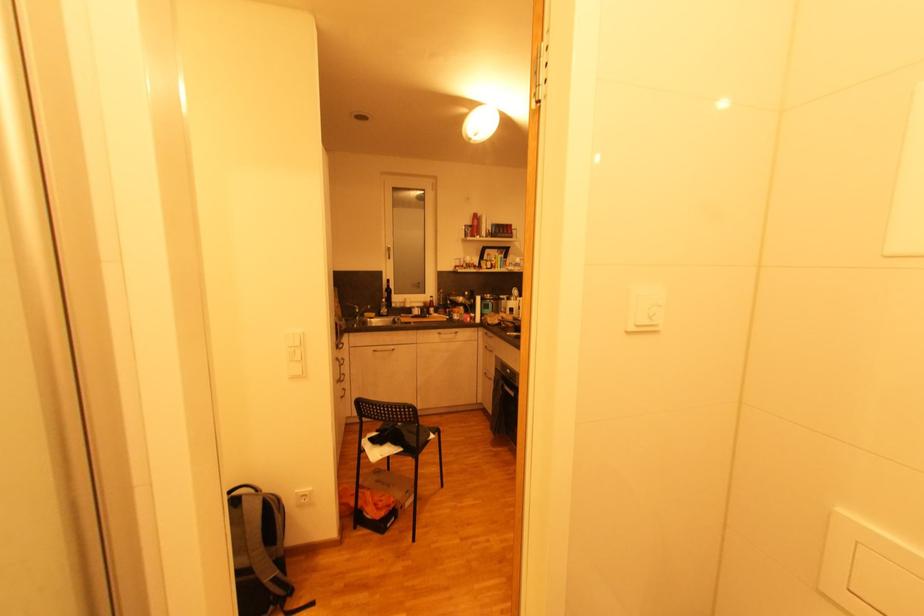
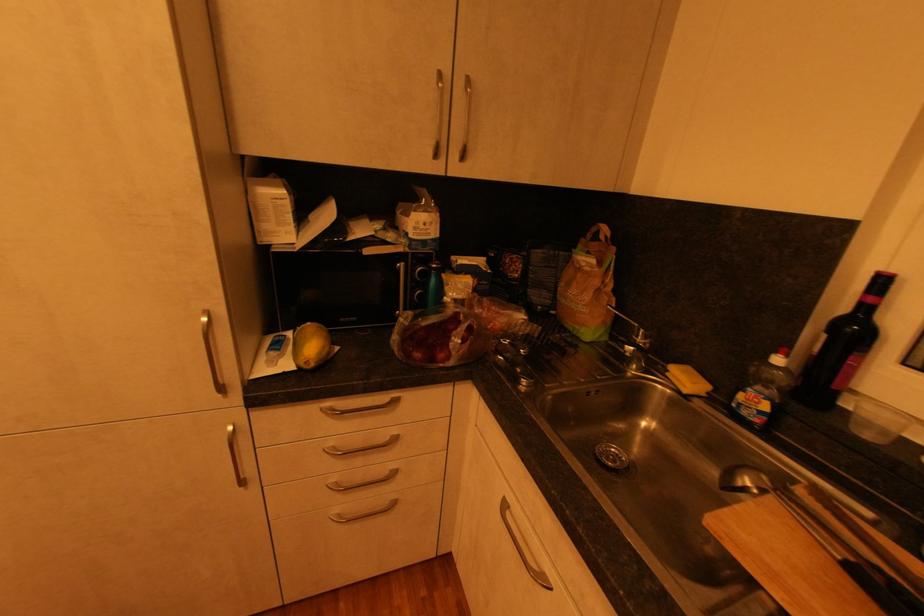
Question: I am providing you with two images of the same scene from different viewpoints. Which of the following objects are not visible in image2?

Choices:
 (A) plastic produce bag
 (B) yellow kitchen sponge
 (C) silver drawer handle
 (D) none of these

Answer: (D)